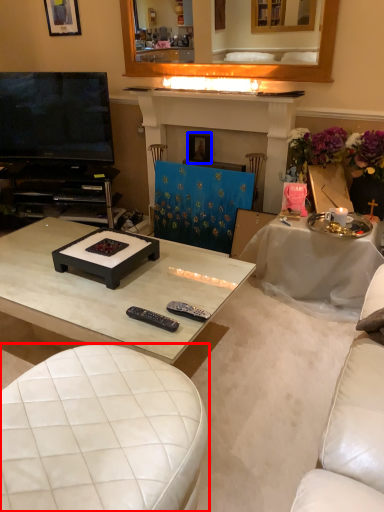
Question: Which object appears farthest to the camera in this image, studio couch (highlighted by a red box) or picture frame (highlighted by a blue box)?

Choices:
 (A) studio couch
 (B) picture frame

Answer: (B)